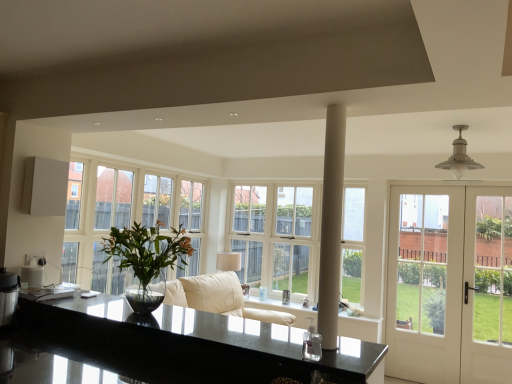
Question: Is white glass window at center bigger than white smooth column at center?

Choices:
 (A) no
 (B) yes

Answer: (B)

Question: Is white glass window at center turned away from white smooth column at center?

Choices:
 (A) no
 (B) yes

Answer: (A)

Question: From a real-world perspective, does white glass window at center sit lower than white smooth column at center?

Choices:
 (A) no
 (B) yes

Answer: (B)

Question: From the image's perspective, is white glass window at center beneath white smooth column at center?

Choices:
 (A) no
 (B) yes

Answer: (B)

Question: Is white glass window at center not within white smooth column at center?

Choices:
 (A) no
 (B) yes

Answer: (B)

Question: Could you tell me if white glass window at center is turned towards white smooth column at center?

Choices:
 (A) no
 (B) yes

Answer: (B)

Question: Is green glossy vase at left to the right of white smooth column at center from the viewer's perspective?

Choices:
 (A) yes
 (B) no

Answer: (B)

Question: Does green glossy vase at left have a larger size compared to white smooth column at center?

Choices:
 (A) yes
 (B) no

Answer: (A)

Question: Is green glossy vase at left far from white smooth column at center?

Choices:
 (A) yes
 (B) no

Answer: (B)

Question: Can you confirm if green glossy vase at left is wider than white smooth column at center?

Choices:
 (A) no
 (B) yes

Answer: (B)

Question: Does green glossy vase at left have a lesser width compared to white smooth column at center?

Choices:
 (A) yes
 (B) no

Answer: (B)

Question: Is green glossy vase at left with white smooth column at center?

Choices:
 (A) yes
 (B) no

Answer: (B)

Question: From a real-world perspective, is white smooth column at center below black granite countertop at center?

Choices:
 (A) yes
 (B) no

Answer: (B)